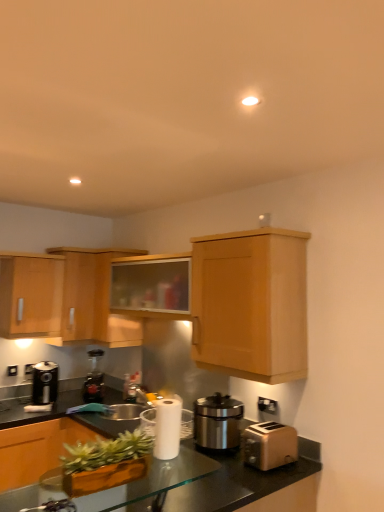
At what (x,y) coordinates should I click in order to perform the action: click on vacant space situated above brown matte toaster at lower right (from a real-world perspective). Please return your answer as a coordinate pair (x, y). Looking at the image, I should click on (268, 426).